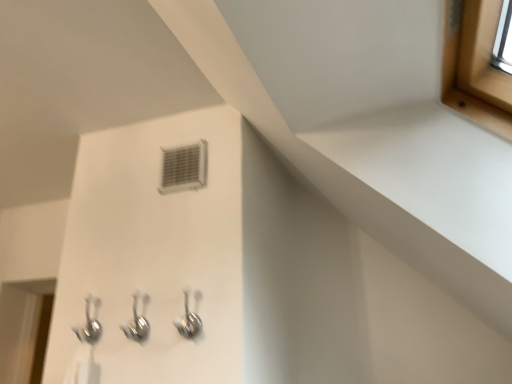
Question: From the image's perspective, relative to polished chrome hooks at lower left, arranged as the third plumbing fixture when viewed from the right, is white plastic air conditioning at center above or below?

Choices:
 (A) above
 (B) below

Answer: (A)

Question: Is point (198, 145) positioned closer to the camera than point (87, 306)?

Choices:
 (A) closer
 (B) farther

Answer: (B)

Question: Which object is the closest to the satin nickel hooks at center, positioned as the 1th plumbing fixture in right-to-left order?

Choices:
 (A) white plastic air conditioning at center
 (B) polished chrome hooks at lower left, which is the first plumbing fixture from left to right
 (C) polished chrome hooks at lower center, which ranks as the second plumbing fixture in right-to-left order

Answer: (C)

Question: Which object is positioned farthest from the satin nickel hooks at center, which ranks as the third plumbing fixture in left-to-right order?

Choices:
 (A) polished chrome hooks at lower center, which ranks as the second plumbing fixture in right-to-left order
 (B) white plastic air conditioning at center
 (C) polished chrome hooks at lower left, which is the first plumbing fixture from left to right

Answer: (B)